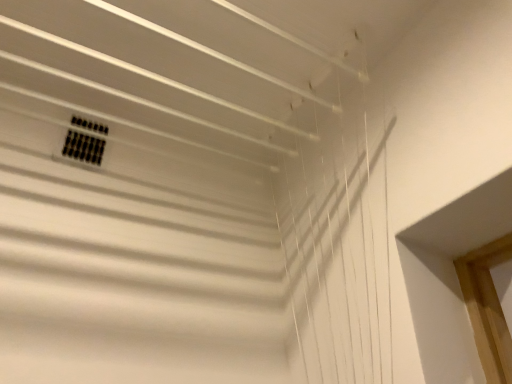
Describe the element at coordinates (85, 141) in the screenshot. I see `black mesh vent at upper left` at that location.

This screenshot has height=384, width=512. I want to click on black mesh vent at upper left, so click(85, 141).

The width and height of the screenshot is (512, 384). What are the coordinates of `black mesh vent at upper left` in the screenshot? It's located at (85, 141).